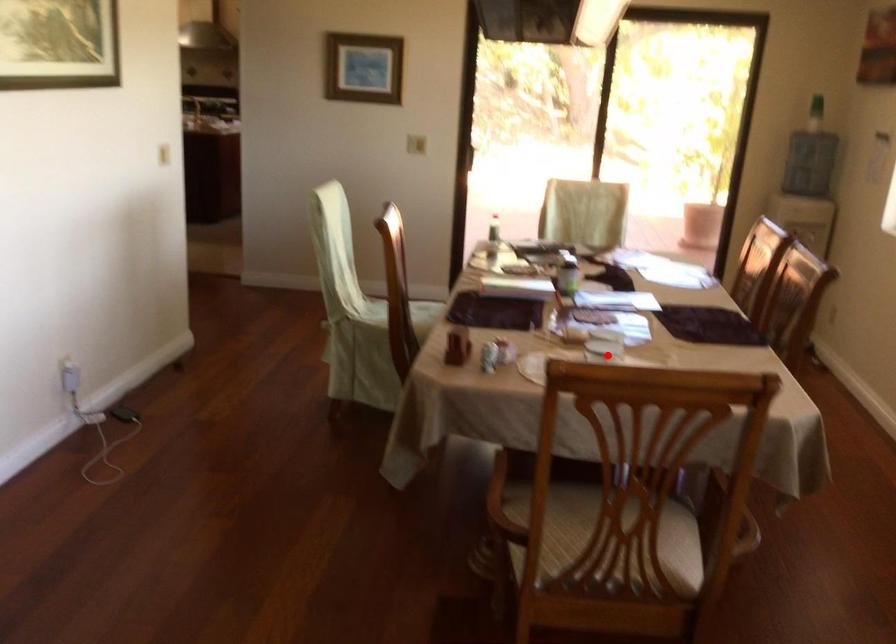
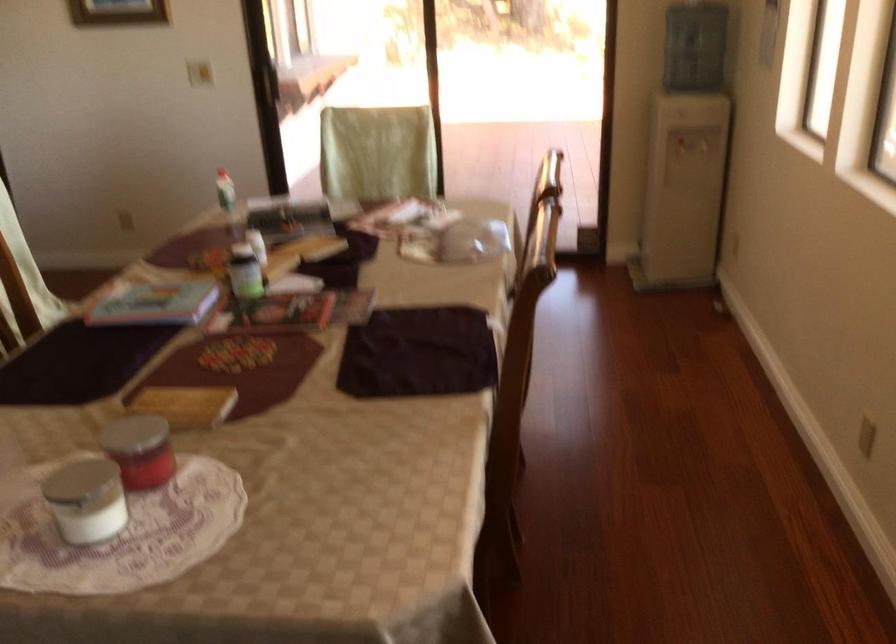
Question: A red point is marked in image1. In image2, is the corresponding 3D point closer to the camera or farther? Reply with the corresponding letter.

Choices:
 (A) The corresponding 3D point is closer.
 (B) The corresponding 3D point is farther.

Answer: (A)